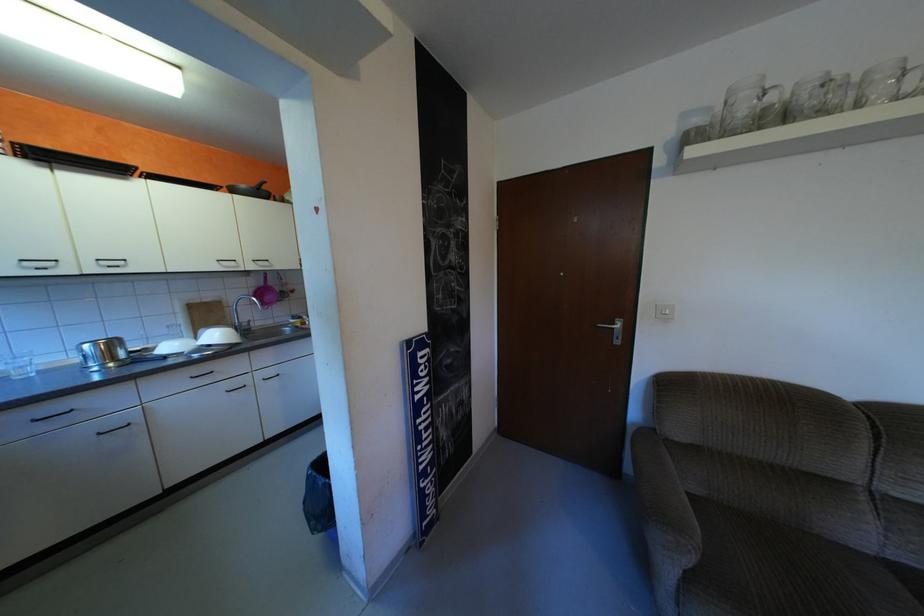
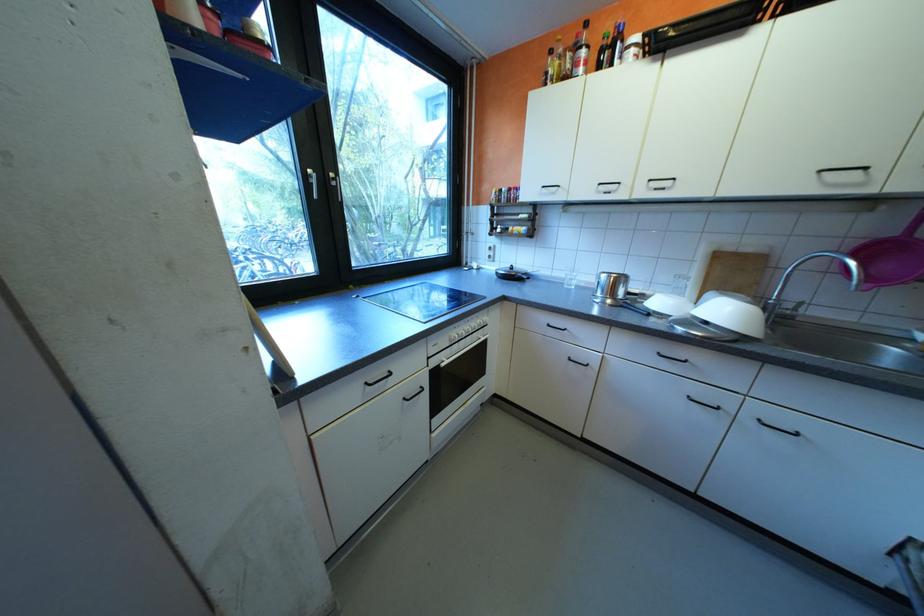
Locate, in the second image, the point that corresponds to (x=227, y=336) in the first image.

(736, 312)